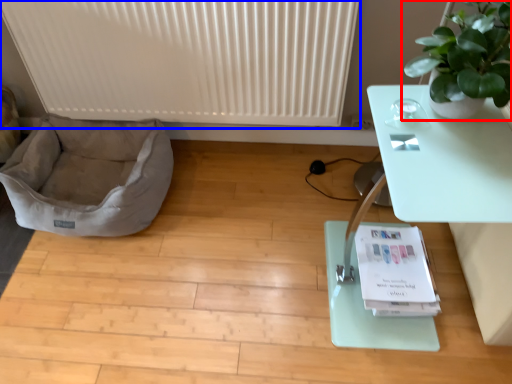
Question: Which object is further to the camera taking this photo, houseplant (highlighted by a red box) or radiator (highlighted by a blue box)?

Choices:
 (A) houseplant
 (B) radiator

Answer: (B)